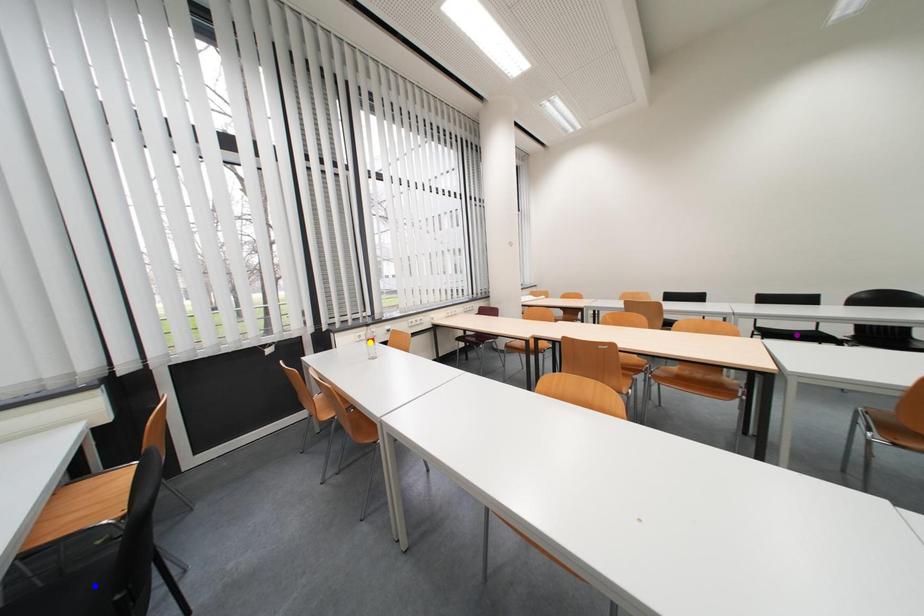
Order these from nearest to farthest:
A) purple point
B) yellow point
C) blue point

yellow point → purple point → blue point